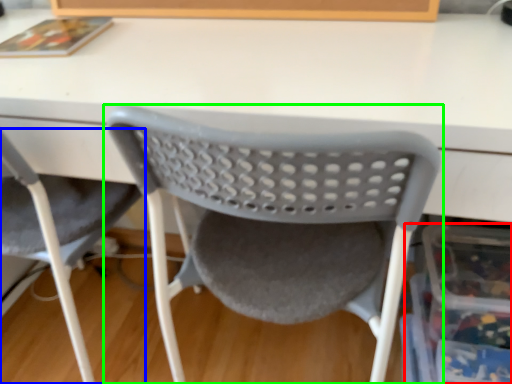
Question: Estimate the real-world distances between objects in this image. Which object is farther from storage box (highlighted by a red box), chair (highlighted by a blue box) or chair (highlighted by a green box)?

Choices:
 (A) chair
 (B) chair

Answer: (A)